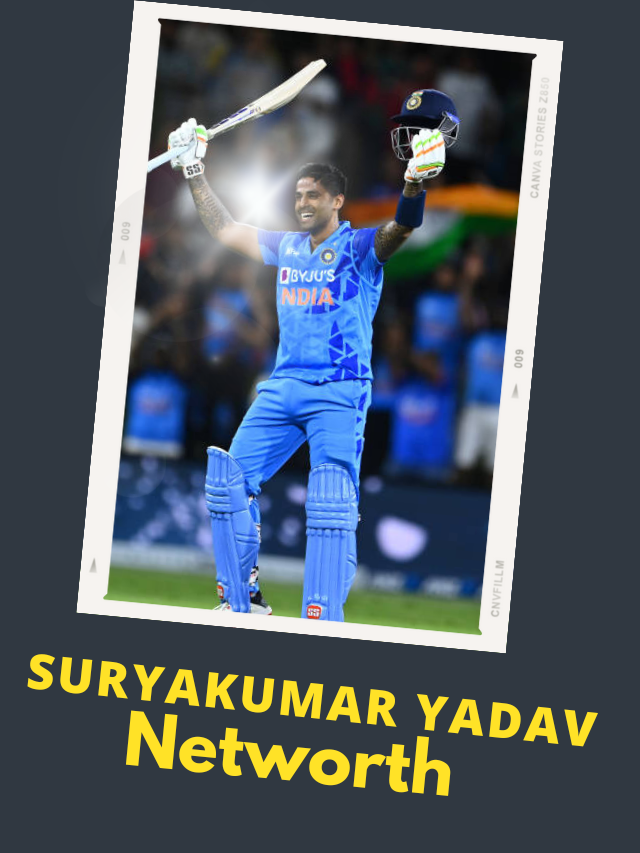
Find the location of a particular element. stand is located at coordinates (451, 511), (138, 514).